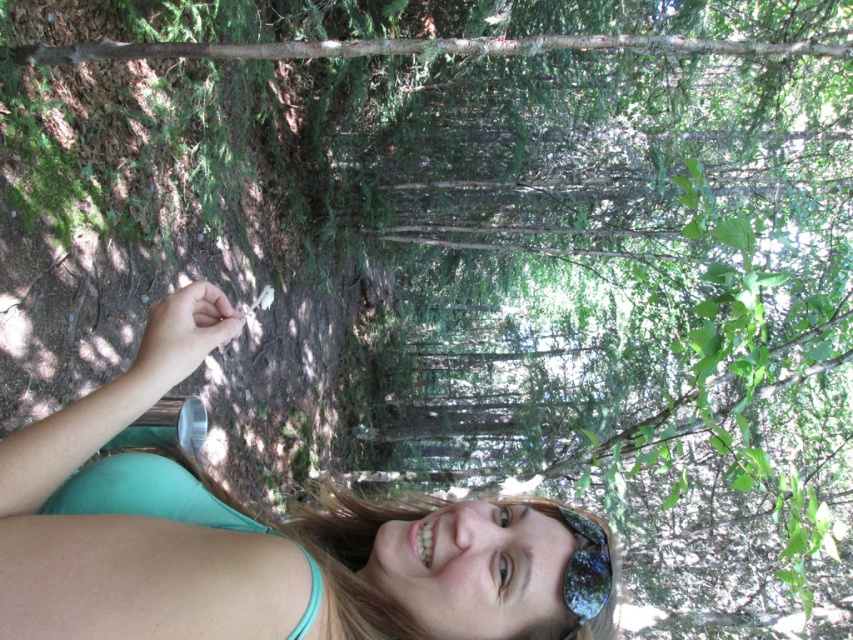
What do you see at coordinates (262, 536) in the screenshot? I see `green fabric shirt at lower left` at bounding box center [262, 536].

Who is more distant from viewer, (361,637) or (68,593)?

The point (361,637) is behind.

Is point (186, 502) closer to camera compared to point (91, 506)?

That is False.

I want to click on green fabric shirt at lower left, so click(262, 536).

Is green fabric shirt at lower left below shiny reflective sunglasses at lower center?

No.

Between point (42, 476) and point (593, 634), which one is positioned behind?

Point (593, 634)

Is point (357, 520) farther from viewer compared to point (577, 596)?

Yes, it is behind point (577, 596).

I want to click on green fabric shirt at lower left, so click(x=262, y=536).

The width and height of the screenshot is (853, 640). I want to click on teal fabric bikini top at lower left, so click(x=144, y=541).

Does teal fabric bikini top at lower left come behind shiny reflective sunglasses at lower center?

No, teal fabric bikini top at lower left is in front of shiny reflective sunglasses at lower center.

In order to click on teal fabric bikini top at lower left in this screenshot , I will do `click(144, 541)`.

Identify the location of teal fabric bikini top at lower left. The image size is (853, 640). (144, 541).